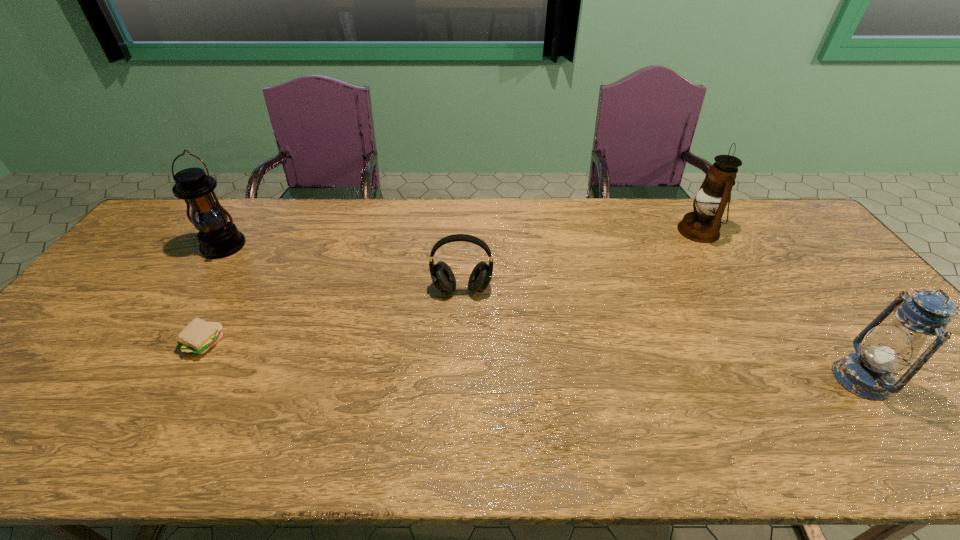
At what (x,y) coordinates should I click in order to perform the action: click on free space at the right edge of the desktop. Please return your answer as a coordinate pair (x, y). Looking at the image, I should click on (828, 269).

In the image, there is a desktop. Identify the location of vacant space at the near right corner. (929, 442).

Where is `vacant space that's between the second lantern from left to right and the nearest lantern`? The width and height of the screenshot is (960, 540). vacant space that's between the second lantern from left to right and the nearest lantern is located at coordinates (780, 305).

This screenshot has width=960, height=540. Find the location of `vacant point located between the patty and the rightmost lantern`. vacant point located between the patty and the rightmost lantern is located at coordinates (531, 361).

Locate an element on the screen. This screenshot has width=960, height=540. free space between the fourth object from left to right and the third farthest object is located at coordinates (580, 260).

You are a GUI agent. You are given a task and a screenshot of the screen. Output one action in this format:
    pyautogui.click(x=<x>, y=<y>)
    Task: Click on the blank region between the leftmost lantern and the headset
    Image resolution: width=960 pixels, height=540 pixels.
    Given the screenshot: What is the action you would take?
    pyautogui.click(x=343, y=268)

Find the location of a particular element. The height and width of the screenshot is (540, 960). free space between the second lantern from left to right and the nearest lantern is located at coordinates (780, 305).

You are a GUI agent. You are given a task and a screenshot of the screen. Output one action in this format:
    pyautogui.click(x=<x>, y=<y>)
    Task: Click on the free space between the rightmost lantern and the shortest object
    The width and height of the screenshot is (960, 540).
    Given the screenshot: What is the action you would take?
    pyautogui.click(x=531, y=361)

This screenshot has width=960, height=540. In order to click on object that is the closest one to the leftmost lantern in this screenshot , I will do `click(198, 336)`.

Locate which object is the second closest to the shortest object. Please provide its 2D coordinates. Your answer should be formatted as a tuple, i.e. [(x, y)], where the tuple contains the x and y coordinates of a point satisfying the conditions above.

[(442, 276)]